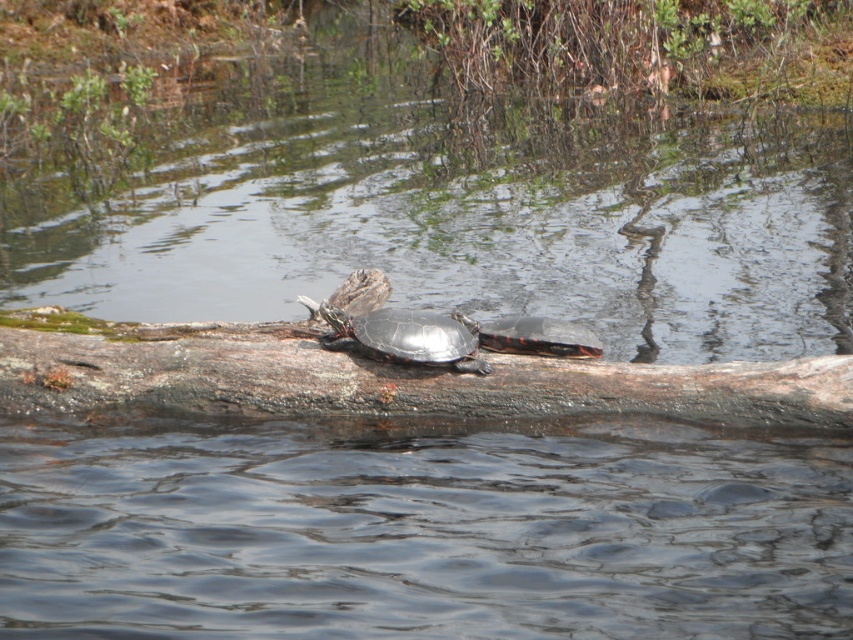
Does point (650, 374) come closer to viewer compared to point (399, 312)?

Yes, it is in front of point (399, 312).

Is smooth brown log at center wider than shiny black turtle at center?

Yes, smooth brown log at center is wider than shiny black turtle at center.

I want to click on smooth brown log at center, so click(386, 378).

Is point (456, 336) more distant than point (573, 349)?

No.

Is point (351, 317) closer to camera compared to point (589, 355)?

Yes, it is in front of point (589, 355).

Which is in front, point (334, 314) or point (498, 346)?

Point (334, 314)

Locate an element on the screen. The image size is (853, 640). shiny black turtle at center is located at coordinates (403, 337).

Based on the photo, which of these two, smooth brown log at center or shiny black tortoise at center, stands taller?

smooth brown log at center

In the scene shown: Does smooth brown log at center have a larger size compared to shiny black tortoise at center?

Indeed, smooth brown log at center has a larger size compared to shiny black tortoise at center.

Locate an element on the screen. smooth brown log at center is located at coordinates (386, 378).

The height and width of the screenshot is (640, 853). I want to click on smooth brown log at center, so click(386, 378).